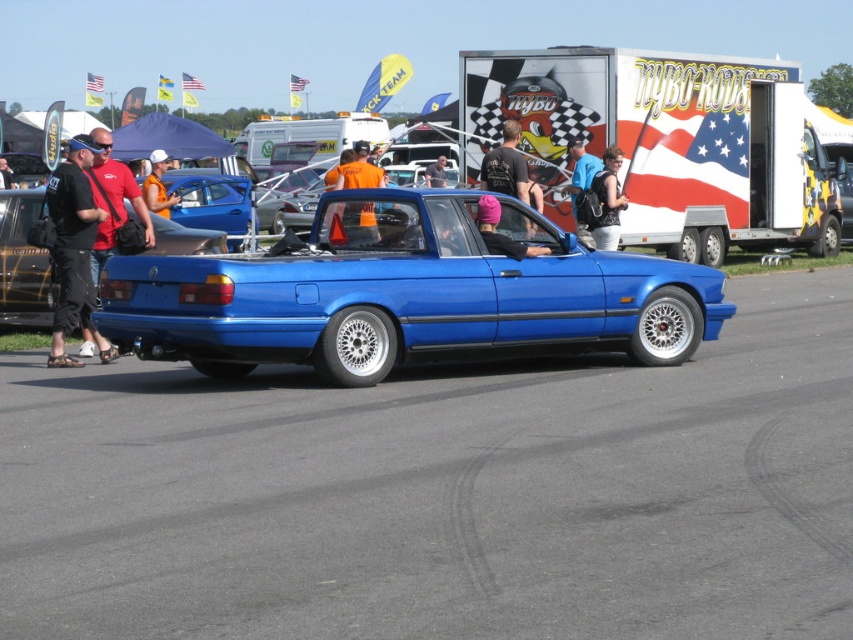
Is black t-shirt at center bigger than matte black jacket at center?

Indeed, black t-shirt at center has a larger size compared to matte black jacket at center.

In order to click on black t-shirt at center in this screenshot , I will do `click(506, 164)`.

Who is lower down, blue fabric backpack at center or matte orange shirt at center?

Positioned lower is blue fabric backpack at center.

Does blue fabric backpack at center have a lesser height compared to matte orange shirt at center?

Yes.

Measure the distance between blue fabric backpack at center and camera.

blue fabric backpack at center and camera are 13.42 meters apart.

This screenshot has height=640, width=853. In order to click on blue fabric backpack at center in this screenshot , I will do `click(581, 184)`.

Is matte blue car at center to the right of pink fabric headband at center from the viewer's perspective?

No, matte blue car at center is not to the right of pink fabric headband at center.

Does matte blue car at center appear on the left side of pink fabric headband at center?

Indeed, matte blue car at center is positioned on the left side of pink fabric headband at center.

Locate an element on the screen. This screenshot has width=853, height=640. matte blue car at center is located at coordinates (212, 202).